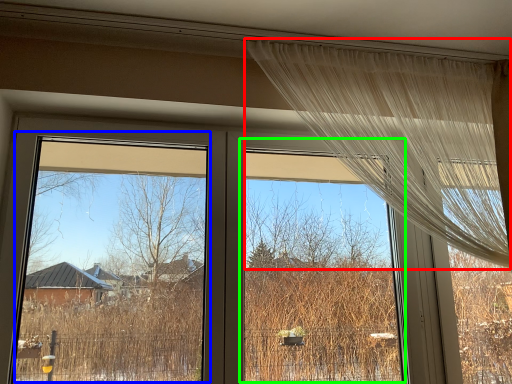
Question: Based on their relative distances, which object is farther from curtain (highlighted by a red box)? Choose from window screen (highlighted by a blue box) and window screen (highlighted by a green box).

Choices:
 (A) window screen
 (B) window screen

Answer: (A)